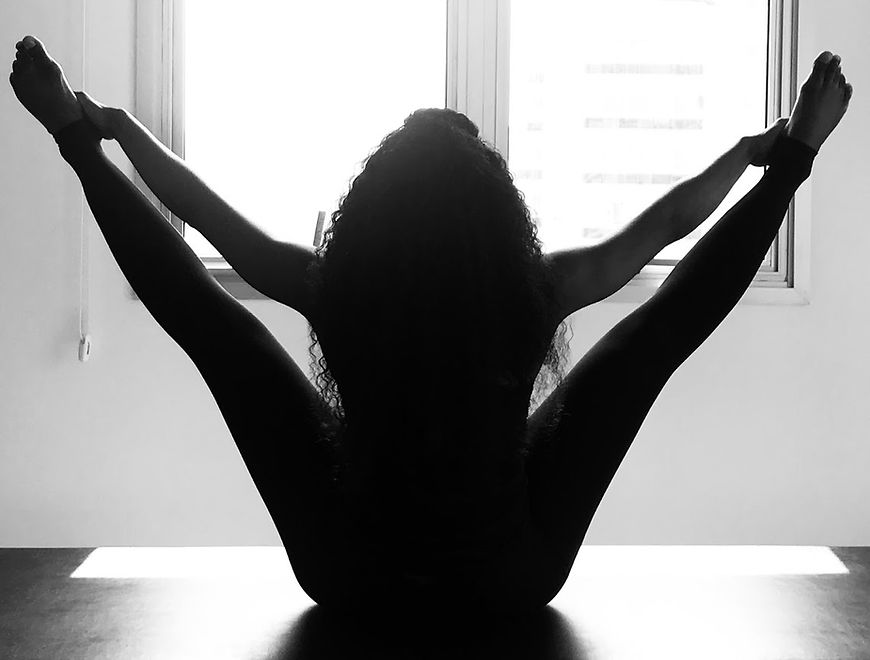
Find the location of a particular element. light is located at coordinates (650, 568).